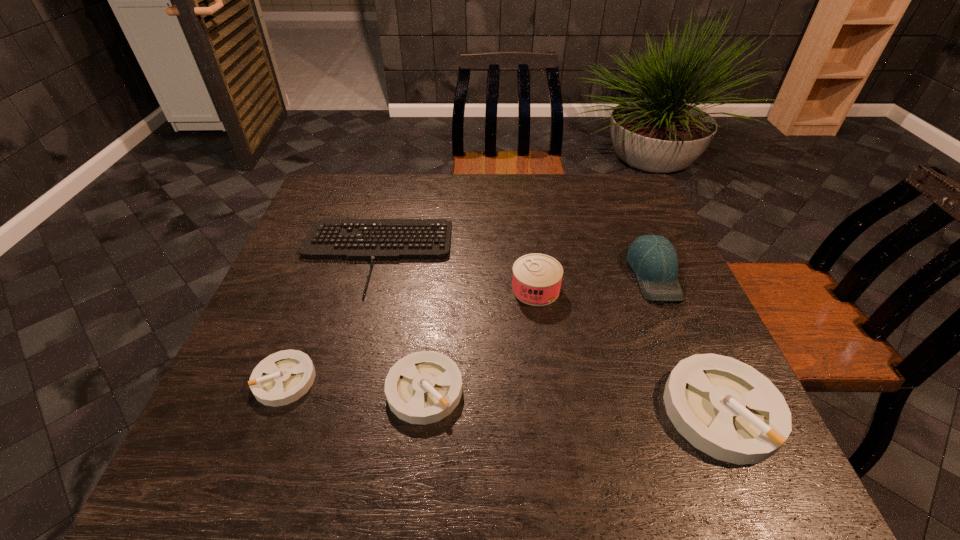
Locate an element on the screen. Image resolution: width=960 pixels, height=540 pixels. the second shortest object is located at coordinates (281, 378).

The image size is (960, 540). I want to click on the shortest ashtray, so click(x=281, y=378).

Locate an element on the screen. The width and height of the screenshot is (960, 540). the second tallest ashtray is located at coordinates (424, 387).

Identify the location of the second ashtray from left to right. Image resolution: width=960 pixels, height=540 pixels. (424, 387).

The image size is (960, 540). In order to click on the tallest ashtray in this screenshot , I will do `click(725, 408)`.

In order to click on the fourth shortest object in this screenshot , I will do `click(725, 408)`.

This screenshot has width=960, height=540. I want to click on the shortest object, so click(x=371, y=240).

The height and width of the screenshot is (540, 960). In order to click on the tallest object in this screenshot , I will do `click(653, 258)`.

This screenshot has height=540, width=960. Find the location of `the third object from right to left`. the third object from right to left is located at coordinates (536, 281).

Locate an element on the screen. The image size is (960, 540). free space located on the back of the leftmost ashtray is located at coordinates (323, 281).